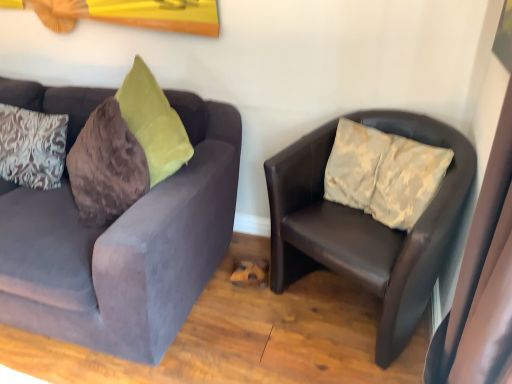
The width and height of the screenshot is (512, 384). In order to click on vacant area situated below leather chair at right, the 2th studio couch viewed from the left (from a real-world perspective) in this screenshot , I will do (x=334, y=301).